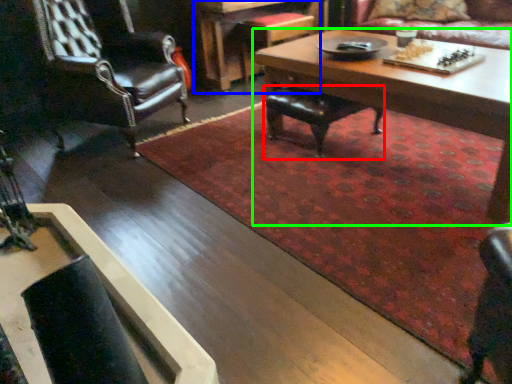
Question: Considering the real-world distances, which object is farthest from chair (highlighted by a red box)? table (highlighted by a blue box) or coffee table (highlighted by a green box)?

Choices:
 (A) table
 (B) coffee table

Answer: (A)